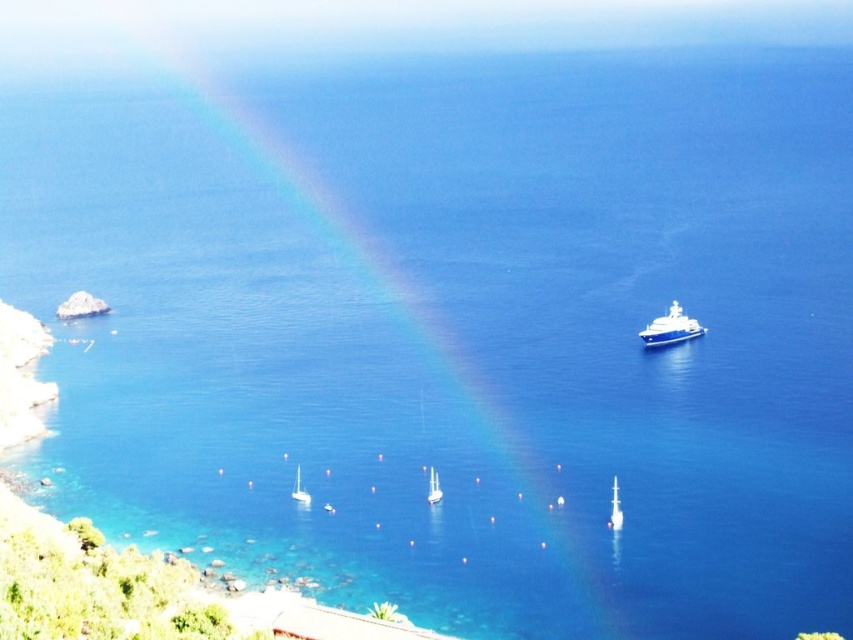
Is white glossy boat at lower center closer to the viewer compared to white glossy sailboat at center?

That is True.

Does white glossy boat at lower center have a lesser height compared to white glossy sailboat at center?

In fact, white glossy boat at lower center may be taller than white glossy sailboat at center.

Between point (608, 518) and point (430, 497), which one is positioned in front?

Point (608, 518) is in front.

Where is `white glossy boat at lower center`? This screenshot has height=640, width=853. white glossy boat at lower center is located at coordinates (614, 508).

Between point (427, 497) and point (297, 492), which one is positioned in front?

Point (427, 497) is more forward.

Does white glossy sailboat at center appear on the right side of white glossy sailboat at lower center?

Correct, you'll find white glossy sailboat at center to the right of white glossy sailboat at lower center.

Which is behind, point (440, 493) or point (294, 486)?

The point (294, 486) is behind.

Identify the location of white glossy sailboat at center. This screenshot has width=853, height=640. (433, 486).

Is rainbow at center smaller than white glossy boat at lower center?

No, rainbow at center is not smaller than white glossy boat at lower center.

Between point (544, 504) and point (618, 512), which one is positioned behind?

Positioned behind is point (544, 504).

Between point (532, 448) and point (614, 520), which one is positioned in front?

Point (614, 520) is more forward.

This screenshot has width=853, height=640. Find the location of `rainbow at center`. rainbow at center is located at coordinates (399, 298).